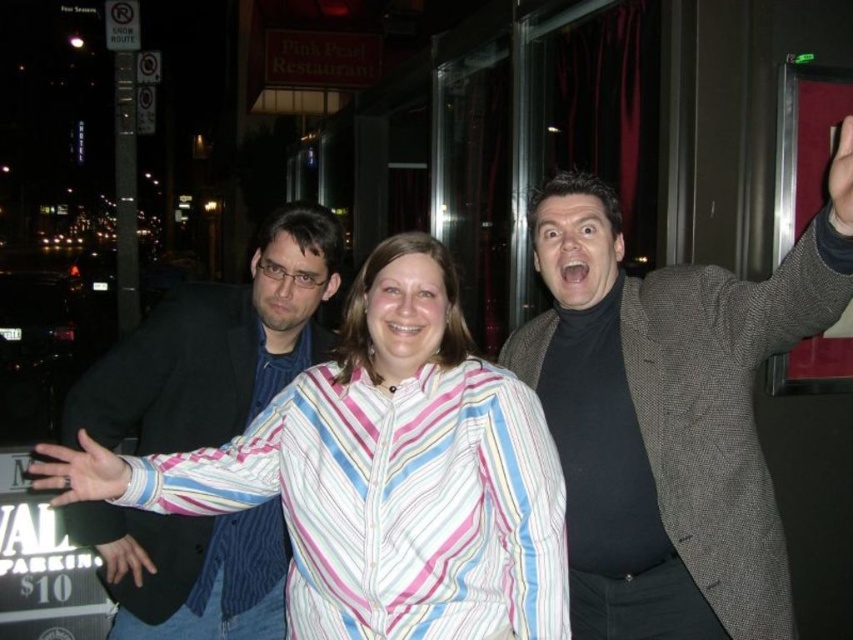
Is dark gray textured blazer at right below dark blue textured blazer at left?

Actually, dark gray textured blazer at right is above dark blue textured blazer at left.

I want to click on dark gray textured blazer at right, so click(x=697, y=384).

The height and width of the screenshot is (640, 853). Find the location of `dark gray textured blazer at right`. dark gray textured blazer at right is located at coordinates (697, 384).

Locate an element on the screen. dark gray textured blazer at right is located at coordinates (697, 384).